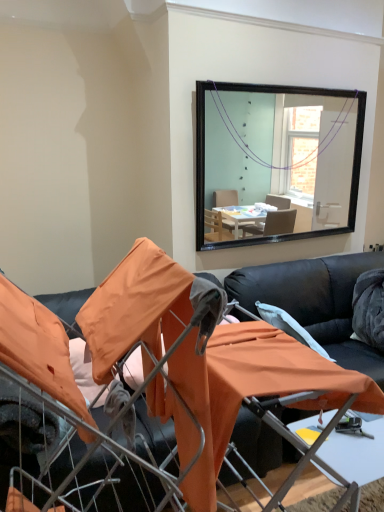
Question: From the image's perspective, is black leather couch at center located above or below white plastic table at lower center?

Choices:
 (A) above
 (B) below

Answer: (A)

Question: Is black leather couch at center spatially inside white plastic table at lower center, or outside of it?

Choices:
 (A) outside
 (B) inside

Answer: (A)

Question: Which object is positioned farthest from the black leather couch at center?

Choices:
 (A) white plastic table at lower center
 (B) black leather couch at center

Answer: (B)

Question: Which of these objects is positioned closest to the white plastic table at lower center?

Choices:
 (A) black leather couch at center
 (B) black leather couch at center

Answer: (A)